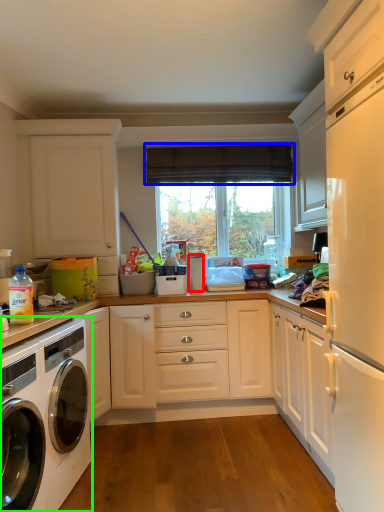
Question: Estimate the real-world distances between objects in this image. Which object is closer to appliance (highlighted by a red box), curtain (highlighted by a blue box) or washing machine (highlighted by a green box)?

Choices:
 (A) curtain
 (B) washing machine

Answer: (A)